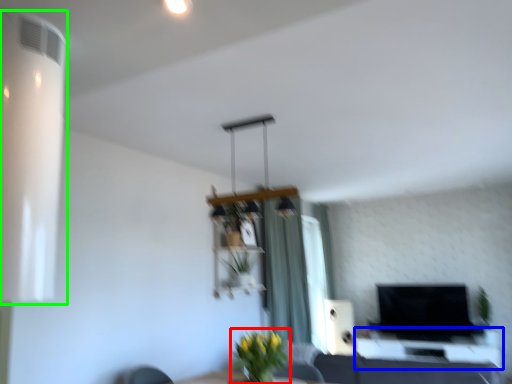
Question: Which object is the farthest from plant (highlighted by a red box)? Choose among these: table (highlighted by a blue box) or air conditioning (highlighted by a green box).

Choices:
 (A) table
 (B) air conditioning

Answer: (A)